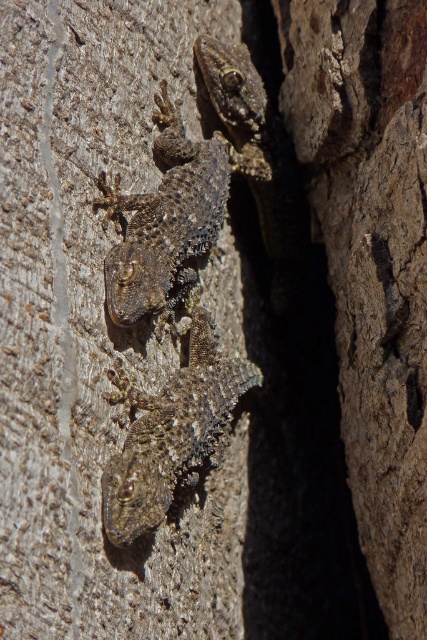
Question: Does rough textured lizard at center come behind scaly brown lizard at center?

Choices:
 (A) yes
 (B) no

Answer: (B)

Question: Where is rough textured lizard at center located in relation to scaly brown lizard at center in the image?

Choices:
 (A) left
 (B) right

Answer: (B)

Question: Among these points, which one is nearest to the camera?

Choices:
 (A) coord(155,458)
 (B) coord(137,269)

Answer: (A)

Question: In this image, where is rough textured lizard at center located relative to scaly brown lizard at center?

Choices:
 (A) right
 (B) left

Answer: (A)